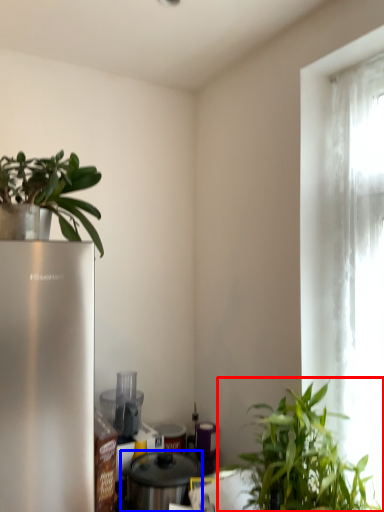
Question: Which object appears closest to the camera in this image, houseplant (highlighted by a red box) or appliance (highlighted by a blue box)?

Choices:
 (A) houseplant
 (B) appliance

Answer: (A)